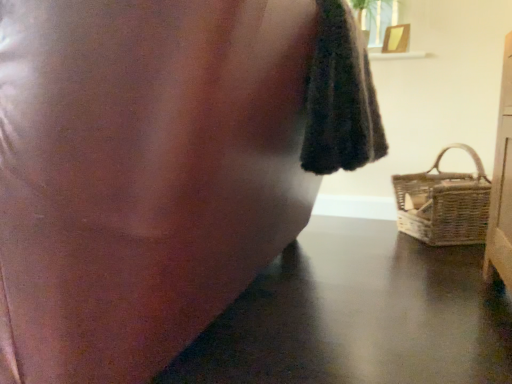
Find the location of a particular element. free spot in front of rustic wicker picnic basket at right is located at coordinates (442, 267).